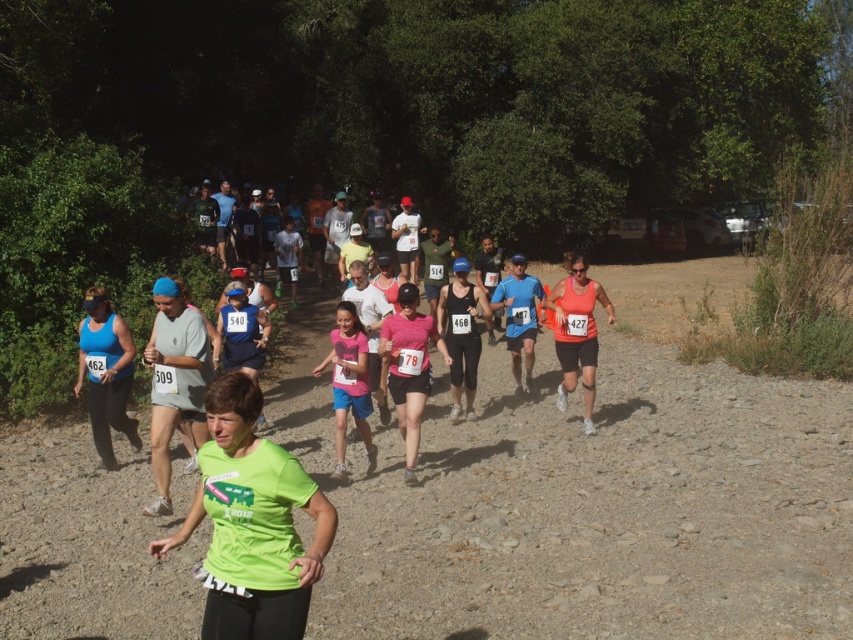
You are a photographer at the race event. You want to capture a photo that includes both the matte blue tank top at left and the pink matte tank top at center. Based on their positions, which runner should be positioned to the left in the photo?

The matte blue tank top at left should be positioned to the left in the photo because it is already to the left of the pink matte tank top at center.

Consider the image. You are a photographer positioned at the starting line of the race. You want to take a photo that includes both the matte blue tank top at left and the orange matte tank top at center. Which runner will appear larger in your photo?

The matte blue tank top at left will appear larger in the photo because it is closer to the viewer than the orange matte tank top at center.

You are a photographer at the race and want to capture both the matte blue tank top at left and the orange matte tank top at center in a single photo. Which runner should be placed on the left side of the photo to ensure both are visible?

The matte blue tank top at left should be placed on the left side of the photo because it is already positioned on the left side of the orange matte tank top at center, ensuring both are visible in the frame.